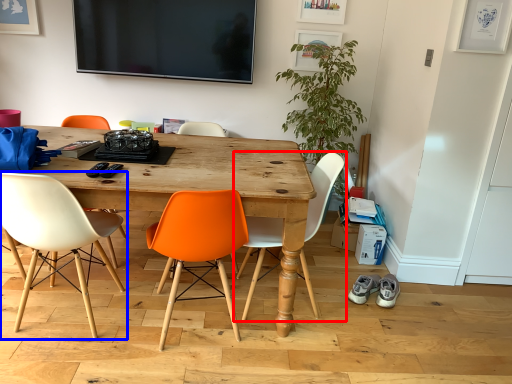
Question: Among these objects, which one is nearest to the camera, chair (highlighted by a red box) or chair (highlighted by a blue box)?

Choices:
 (A) chair
 (B) chair

Answer: (B)